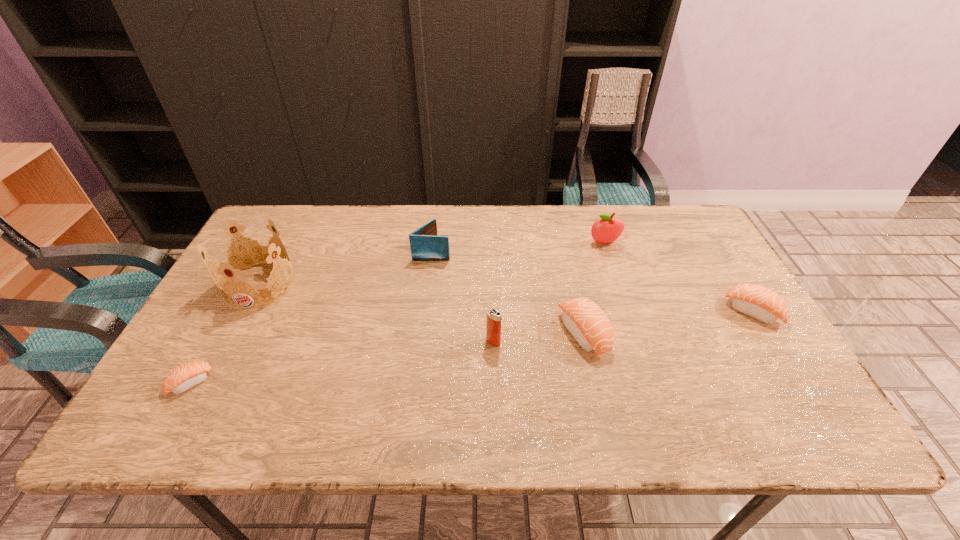
What are the coordinates of `empty location between the crown and the apple` in the screenshot? It's located at (432, 264).

Point out which object is positioned as the sixth nearest to the rightmost object. Please provide its 2D coordinates. Your answer should be formatted as a tuple, i.e. [(x, y)], where the tuple contains the x and y coordinates of a point satisfying the conditions above.

[(184, 377)]

Select which object is the fifth closest to the fifth object from left to right. Please provide its 2D coordinates. Your answer should be formatted as a tuple, i.e. [(x, y)], where the tuple contains the x and y coordinates of a point satisfying the conditions above.

[(246, 257)]

This screenshot has width=960, height=540. Identify the location of sushi that can be found as the second closest to the fourth object from right to left. click(x=758, y=302).

The image size is (960, 540). Find the location of `sushi that is the nearest to the nearest sushi`. sushi that is the nearest to the nearest sushi is located at coordinates (587, 323).

Find the location of a particular element. This screenshot has width=960, height=540. blank area in the image that satisfies the following two spatial constraints: 1. on the exterior surface of the fifth object from right to left; 2. on the front side of the shortest sushi is located at coordinates (416, 383).